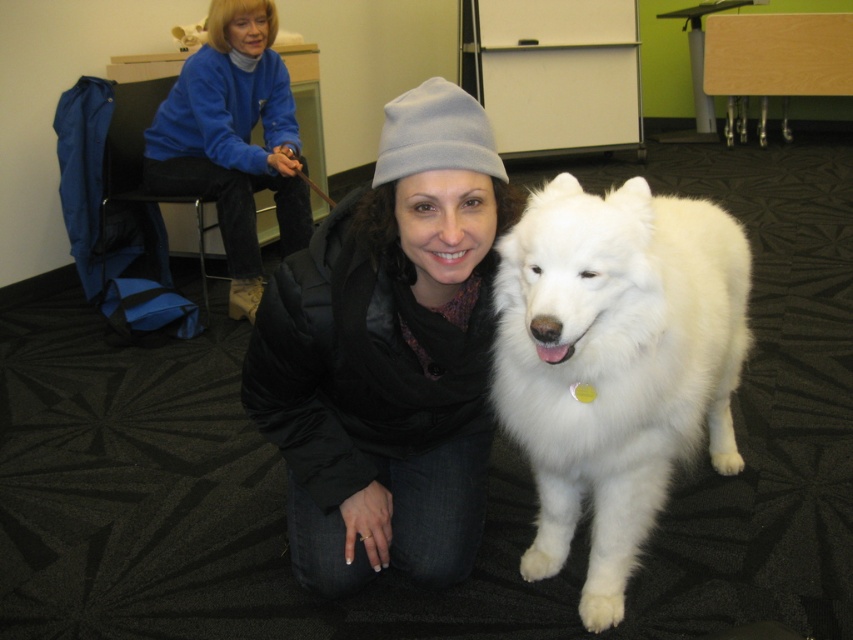
You are trying to decide which jacket to wear for a cold day. You see the black puffy jacket at center and the blue fleece jacket at upper left in the image. Which one is bigger and might keep you warmer?

The blue fleece jacket at upper left is bigger than the black puffy jacket at center, so it might keep you warmer.

You are a photographer setting up a tripod to take a photo of the white fluffy dog at center and the blue fleece jacket at upper left. The tripod has a height adjustment that can only accommodate objects up to 1 meter tall. Which object should you focus on first to ensure it fits within the frame without needing to adjust the tripod height?

The white fluffy dog at center is shorter than the blue fleece jacket at upper left, so you should focus on the blue fleece jacket at upper left first to ensure it fits within the frame without needing to adjust the tripod height.

You are a photographer adjusting your camera to focus on two points in the scene. The first point is point (x=469, y=369) and the second is point (x=679, y=403). Which point is closer to your camera?

Point (x=469, y=369) is further to the camera than point (x=679, y=403), so the first point is closer to the camera.